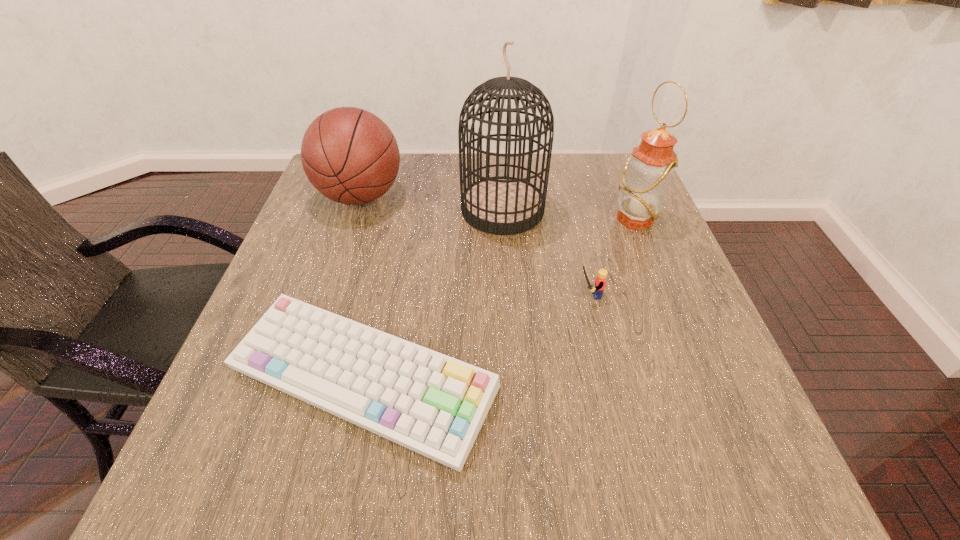
Identify the location of free point that satisfies the following two spatial constraints: 1. on the front-facing side of the fourth tallest object; 2. on the front side of the shortest object. This screenshot has height=540, width=960. (608, 379).

This screenshot has height=540, width=960. Find the location of `free point that satisfies the following two spatial constraints: 1. on the front side of the birdcage; 2. on the left side of the basketball`. free point that satisfies the following two spatial constraints: 1. on the front side of the birdcage; 2. on the left side of the basketball is located at coordinates (356, 209).

This screenshot has height=540, width=960. I want to click on vacant area that satisfies the following two spatial constraints: 1. on the front side of the second tallest object; 2. on the front-facing side of the second shortest object, so click(665, 295).

Where is `vacant region that satisfies the following two spatial constraints: 1. on the front side of the rightmost object; 2. on the left side of the birdcage`? vacant region that satisfies the following two spatial constraints: 1. on the front side of the rightmost object; 2. on the left side of the birdcage is located at coordinates (503, 219).

Where is `vacant space that satisfies the following two spatial constraints: 1. on the front side of the nearest object; 2. on the right side of the third shortest object`? vacant space that satisfies the following two spatial constraints: 1. on the front side of the nearest object; 2. on the right side of the third shortest object is located at coordinates (300, 379).